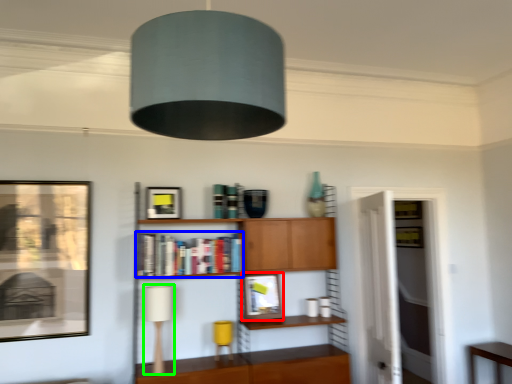
Question: Based on their relative distances, which object is nearer to picture frame (highlighted by a red box)? Choose from book (highlighted by a blue box) and table lamp (highlighted by a green box).

Choices:
 (A) book
 (B) table lamp

Answer: (A)